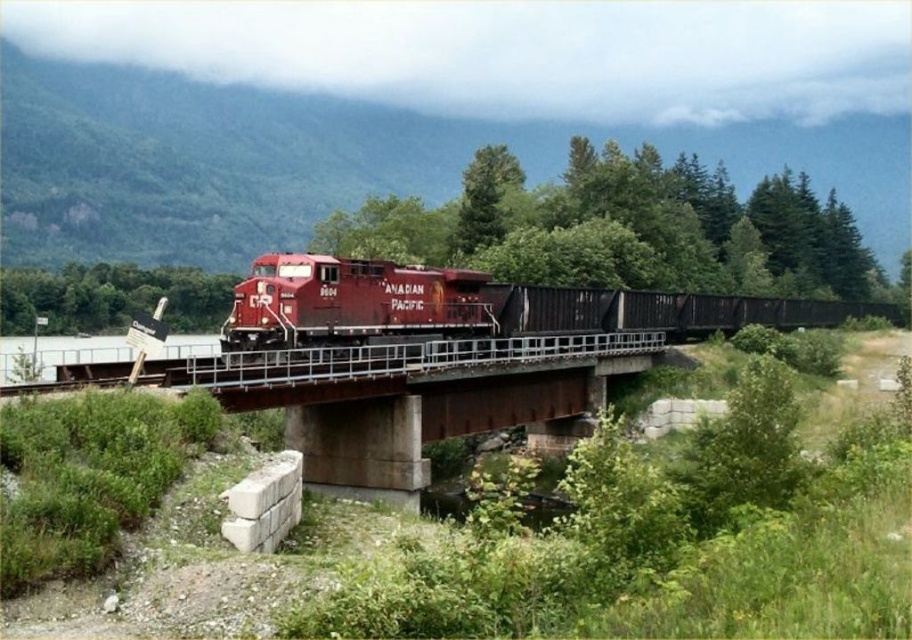
You are a train engineer driving the Canadian Pacific locomotive crossing the bridge. You notice a green leafy tree at center in your path. Based on its coordinates, is the tree directly in the center of the bridge?

The green leafy tree at center is located at coordinates point (622, 227), which means it is positioned at the center of the bridge.

You are a photographer planning to take a wide shot of the Canadian Pacific Railway locomotive and the surrounding scenery. You want to ensure the green leafy tree at center and the matte red locomotive at center are both in frame. Based on their sizes, which object will occupy more space in your photo?

The green leafy tree at center will occupy more space in the photo because its width is larger than that of the matte red locomotive at center.

You are a train engineer operating the matte red locomotive at center. You need to cross the rusty metal bridge at center. Based on the size comparison between the two, do you think the bridge can support the weight of the locomotive?

The rusty metal bridge at center has a smaller size compared to the matte red locomotive at center. However, the description does not provide information about the bridge capacity or the locomotive weight. Therefore, it is impossible to determine if the bridge can support the weight of the matte red locomotive at center based on the given information.